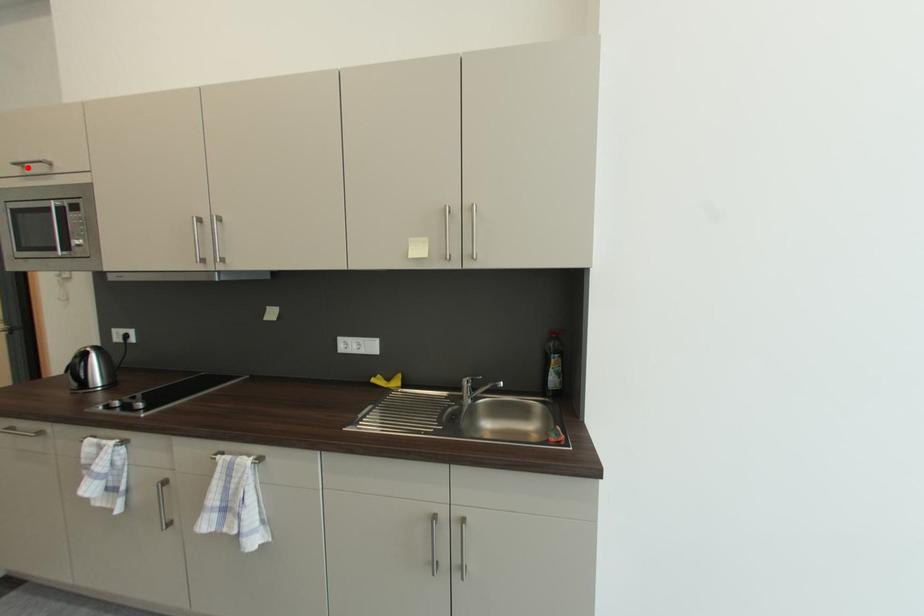
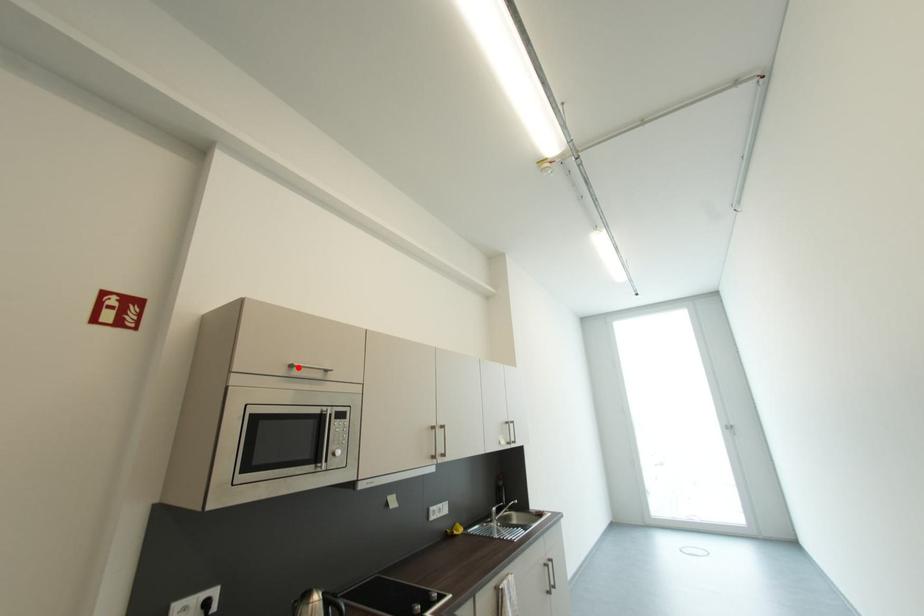
I am providing you with two images of the same scene from different viewpoints. A red point is marked on the first image and another point is marked on the second image. Are the points marked in image1 and image2 representing the same 3D position?

Yes